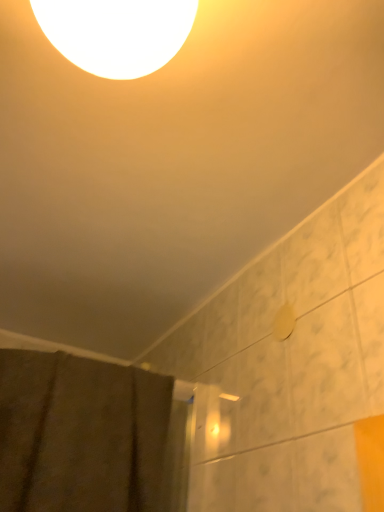
Question: Should I look upward or downward to see white glossy light at upper center?

Choices:
 (A) up
 (B) down

Answer: (A)

Question: From a real-world perspective, is white glossy light at upper center beneath brown textured fabric at lower left?

Choices:
 (A) no
 (B) yes

Answer: (A)

Question: From the image's perspective, is white glossy light at upper center under brown textured fabric at lower left?

Choices:
 (A) yes
 (B) no

Answer: (B)

Question: Is white glossy light at upper center not within brown textured fabric at lower left?

Choices:
 (A) yes
 (B) no

Answer: (A)

Question: Considering the relative positions of white glossy light at upper center and brown textured fabric at lower left in the image provided, is white glossy light at upper center to the right of brown textured fabric at lower left from the viewer's perspective?

Choices:
 (A) yes
 (B) no

Answer: (A)

Question: Is white glossy light at upper center to the left of brown textured fabric at lower left from the viewer's perspective?

Choices:
 (A) no
 (B) yes

Answer: (A)

Question: Is white glossy light at upper center smaller than brown textured fabric at lower left?

Choices:
 (A) yes
 (B) no

Answer: (A)

Question: Is brown textured fabric at lower left to the right of white glossy light at upper center from the viewer's perspective?

Choices:
 (A) no
 (B) yes

Answer: (A)

Question: Can you confirm if brown textured fabric at lower left is positioned to the left of white glossy light at upper center?

Choices:
 (A) yes
 (B) no

Answer: (A)

Question: Considering the relative sizes of brown textured fabric at lower left and white glossy light at upper center in the image provided, is brown textured fabric at lower left thinner than white glossy light at upper center?

Choices:
 (A) no
 (B) yes

Answer: (A)

Question: Is brown textured fabric at lower left in contact with white glossy light at upper center?

Choices:
 (A) no
 (B) yes

Answer: (A)

Question: Can you confirm if brown textured fabric at lower left is shorter than white glossy light at upper center?

Choices:
 (A) yes
 (B) no

Answer: (B)

Question: Would you consider brown textured fabric at lower left to be distant from white glossy light at upper center?

Choices:
 (A) yes
 (B) no

Answer: (B)

Question: Considering the positions of white glossy light at upper center and brown textured fabric at lower left in the image, is white glossy light at upper center taller or shorter than brown textured fabric at lower left?

Choices:
 (A) short
 (B) tall

Answer: (A)